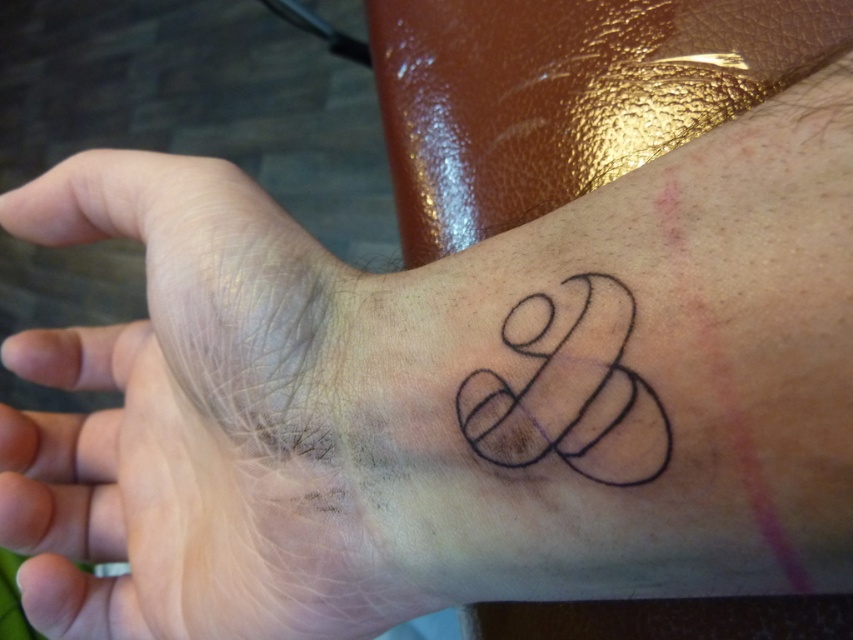
Does skin/hair at lower left have a greater width compared to black ink tattoo at wrist?

Correct, the width of skin/hair at lower left exceeds that of black ink tattoo at wrist.

Between skin/hair at lower left and black ink tattoo at wrist, which one appears on the left side from the viewer's perspective?

Positioned to the left is skin/hair at lower left.

What do you see at coordinates (194, 419) in the screenshot?
I see `skin/hair at lower left` at bounding box center [194, 419].

Locate an element on the screen. This screenshot has height=640, width=853. skin/hair at lower left is located at coordinates (194, 419).